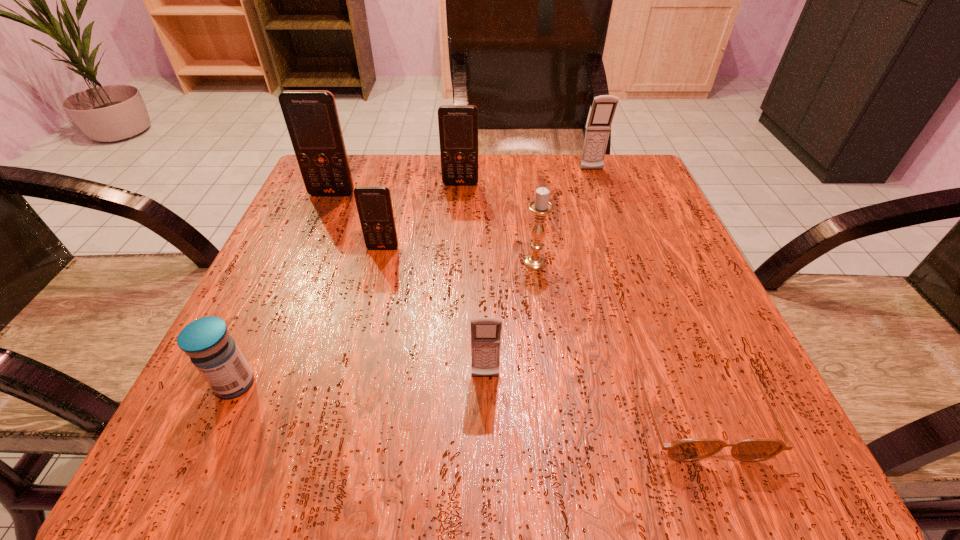
Locate which cellular telephone is the closest to the farther gray cellular telephone. Please provide its 2D coordinates. Your answer should be formatted as a tuple, i.e. [(x, y)], where the tuple contains the x and y coordinates of a point satisfying the conditions above.

[(458, 124)]

What are the coordinates of `orange cellular telephone that is the nearest to the tallest cellular telephone` in the screenshot? It's located at (374, 204).

Select which orange cellular telephone is the closest to the brown sunglasses. Please provide its 2D coordinates. Your answer should be formatted as a tuple, i.e. [(x, y)], where the tuple contains the x and y coordinates of a point satisfying the conditions above.

[(374, 204)]

At what (x,y) coordinates should I click in order to perform the action: click on vacant space that satisfies the following two spatial constraints: 1. on the back side of the sixth object from left to right; 2. on the right side of the medicine. Please return your answer as a coordinate pair (x, y). The width and height of the screenshot is (960, 540). Looking at the image, I should click on pos(291,262).

Image resolution: width=960 pixels, height=540 pixels. In order to click on vacant area that satisfies the following two spatial constraints: 1. on the screen of the second smallest orange cellular telephone; 2. on the left side of the third object from right to left in this screenshot , I will do `click(456, 262)`.